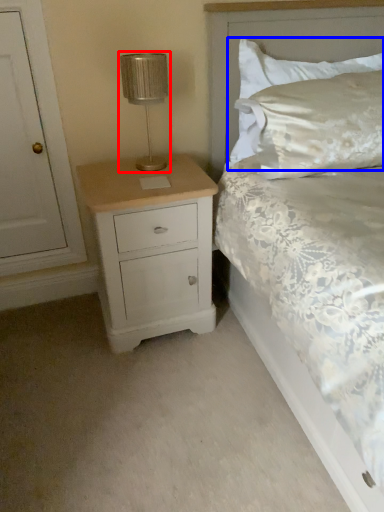
Question: Which object appears farthest to the camera in this image, table lamp (highlighted by a red box) or pillow (highlighted by a blue box)?

Choices:
 (A) table lamp
 (B) pillow

Answer: (B)